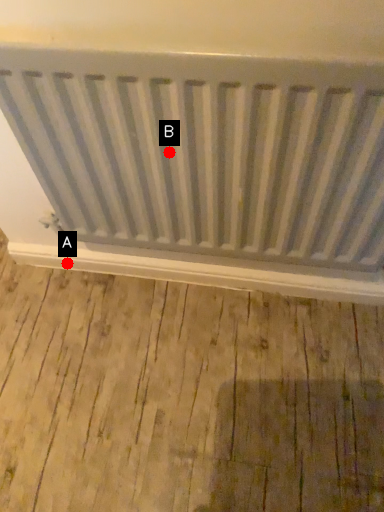
Question: Two points are circled on the image, labeled by A and B beside each circle. Among these points, which one is farthest from the camera?

Choices:
 (A) A is further
 (B) B is further

Answer: (A)